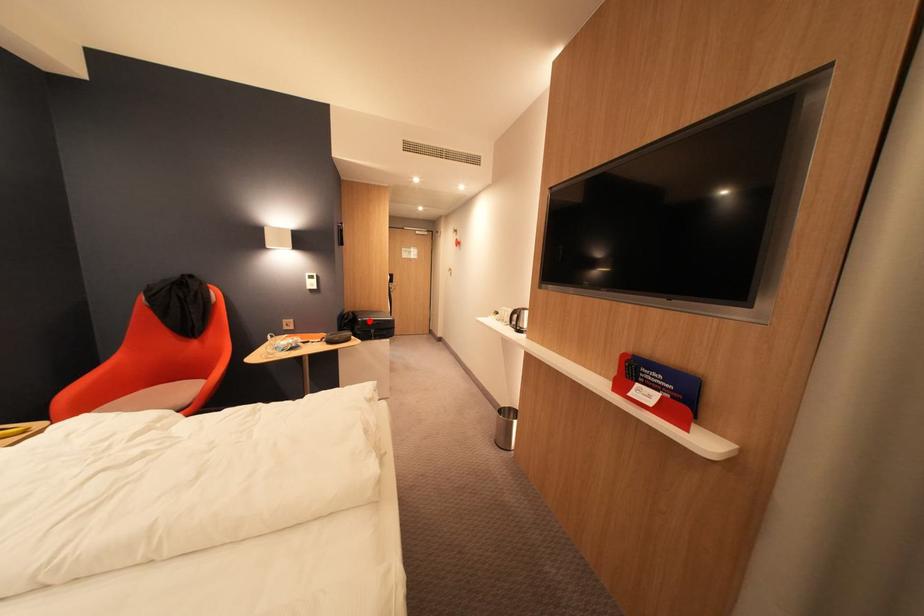
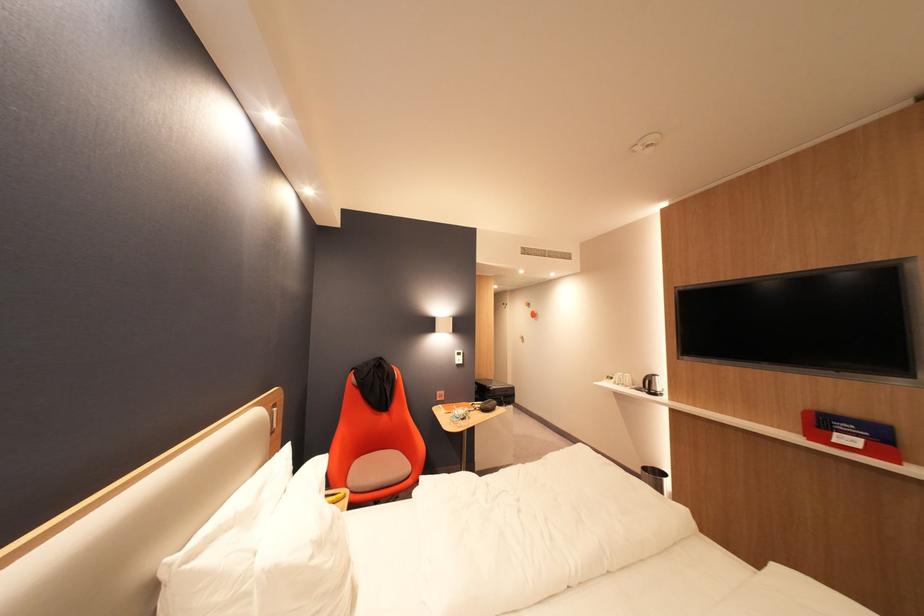
The point at the highlighted location is marked in the first image. Where is the corresponding point in the second image?

(502, 390)